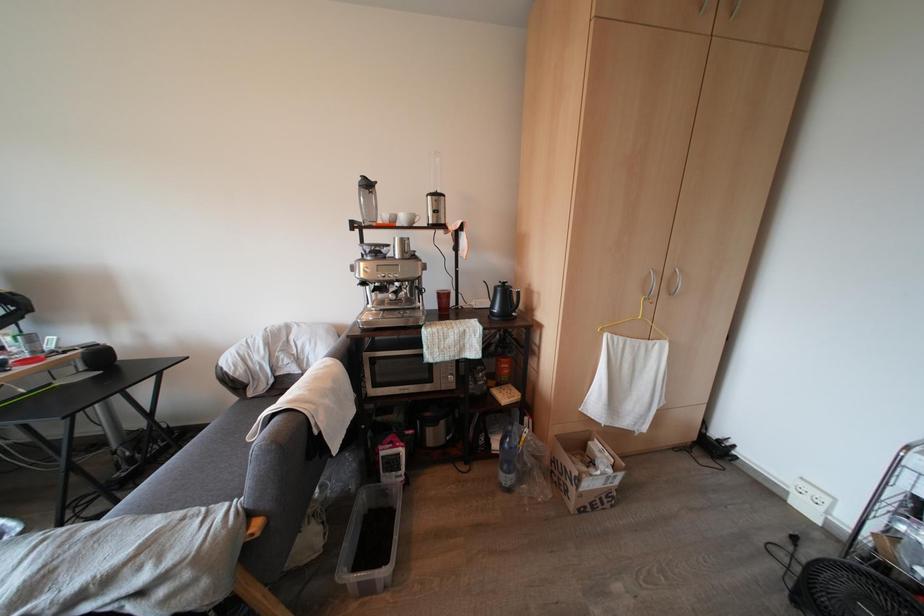
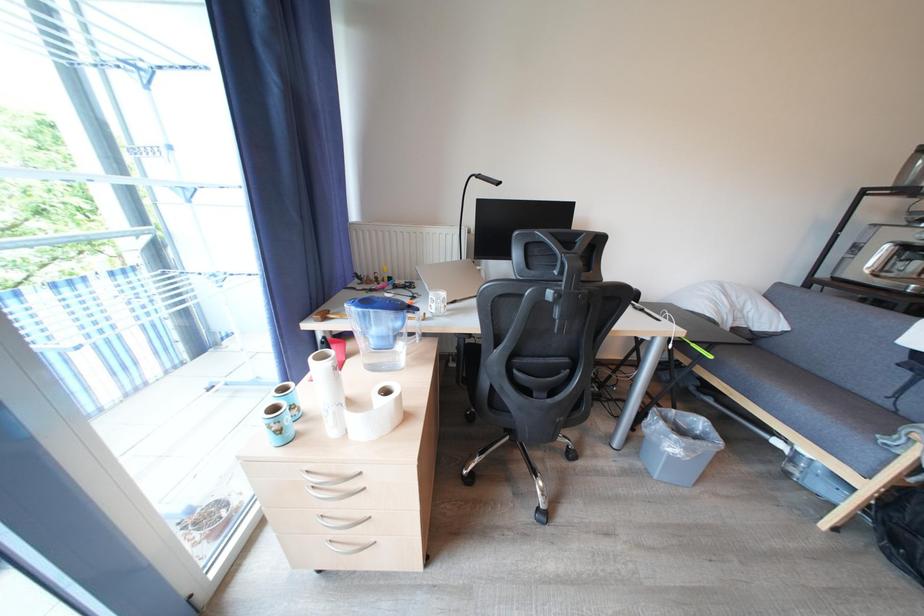
Question: What movement of the cameraman would produce the second image?

Choices:
 (A) Left
 (B) Right
 (C) Forward
 (D) Backward

Answer: (A)